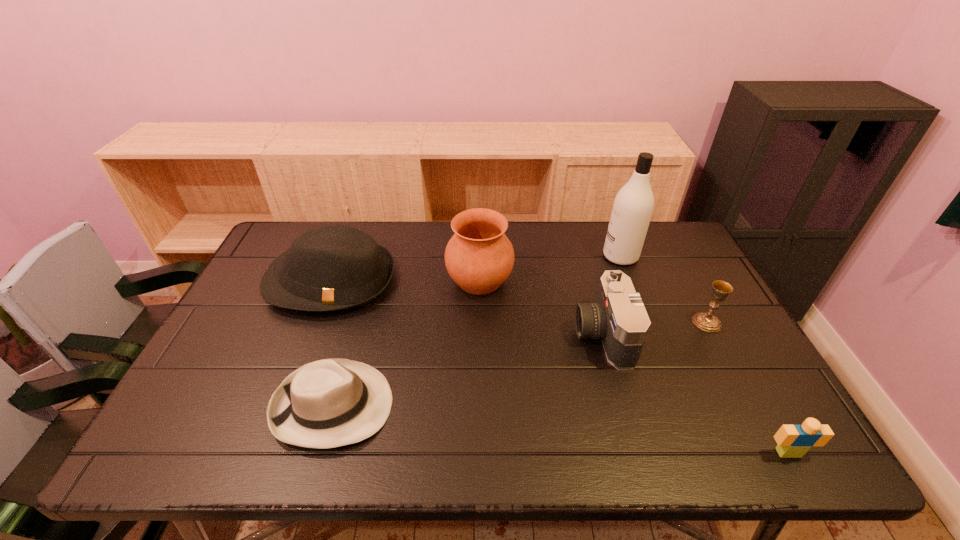
Where is `free space between the shorter fedora and the Lego`? free space between the shorter fedora and the Lego is located at coordinates click(561, 429).

I want to click on the sixth closest object to the camera, so click(x=336, y=267).

I want to click on object that can be found as the sixth closest to the nearer fedora, so click(794, 441).

Find the location of a particular element. vacant region that satisfies the following two spatial constraints: 1. on the front-facing side of the chalice; 2. on the left side of the shampoo is located at coordinates (646, 322).